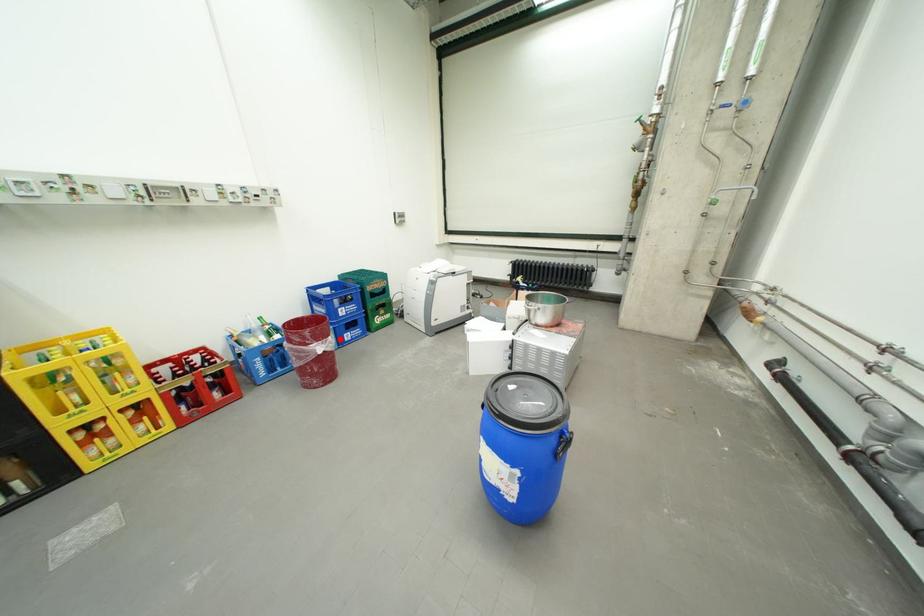
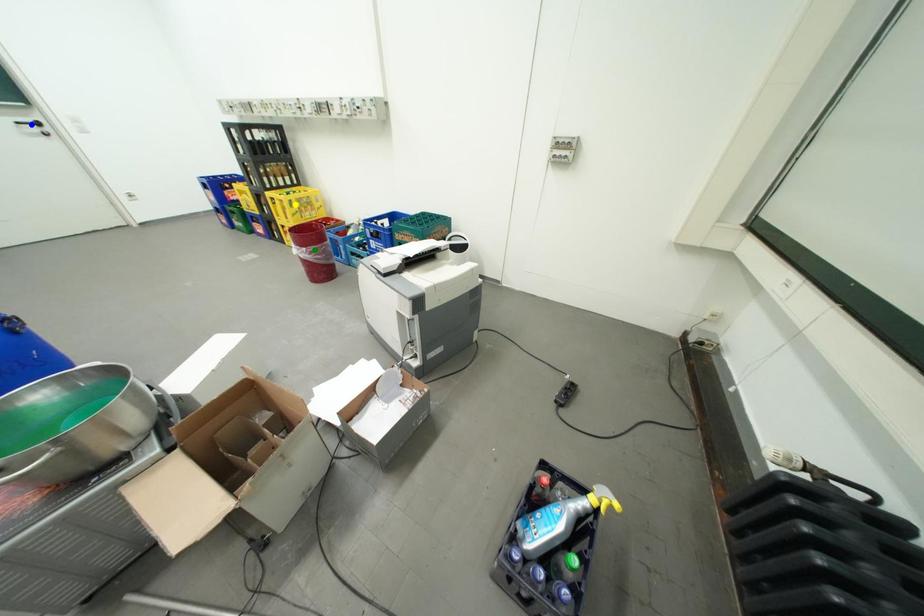
Question: I am providing you with two images of the same scene from different viewpoints. A red point is marked on the first image. You are given multiple points on the second image. Which point in image 2 represents the same 3d spot as the red point in image 1?

Choices:
 (A) blue point
 (B) green point
 (C) yellow point

Answer: (B)